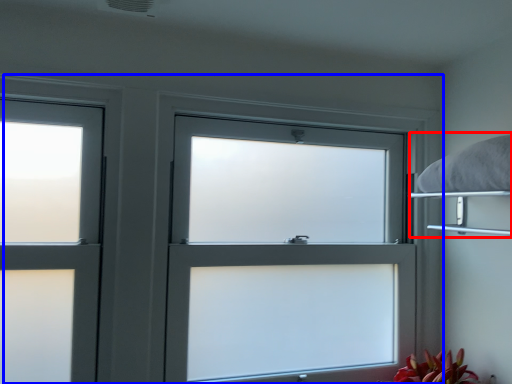
Question: Among these objects, which one is farthest to the camera, bed (highlighted by a red box) or window (highlighted by a blue box)?

Choices:
 (A) bed
 (B) window

Answer: (B)